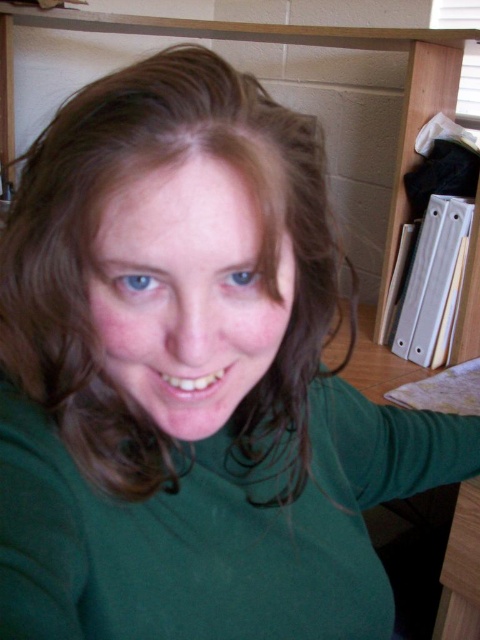
Which is behind, point (147, 280) or point (235, 273)?

Point (235, 273)

Is point (131, 278) more distant than point (252, 275)?

No, it is in front of (252, 275).

Which is behind, point (115, 280) or point (228, 285)?

Point (228, 285)

At what (x,y) coordinates should I click in order to perform the action: click on blue matte eye at center. Please return your answer as a coordinate pair (x, y). Looking at the image, I should click on (136, 284).